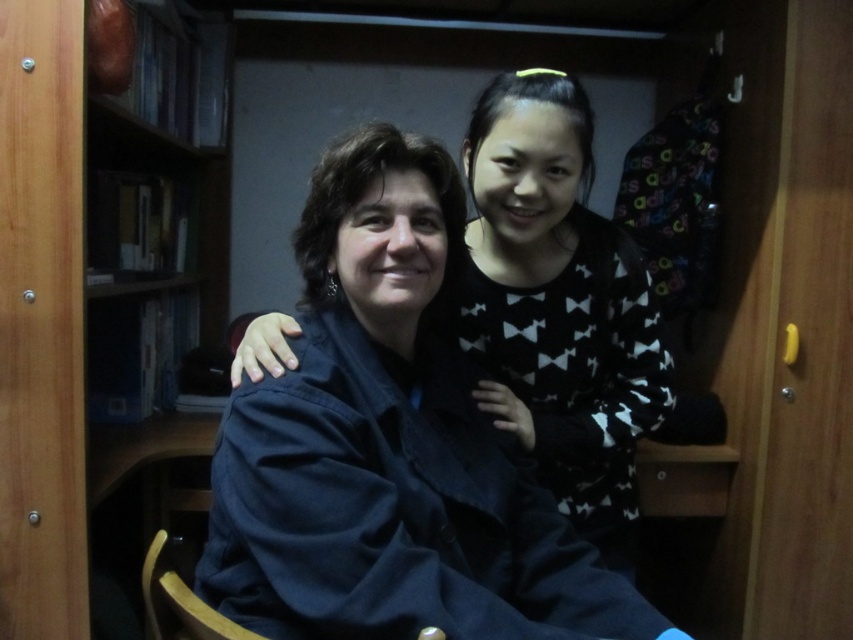
Can you confirm if dark blue cotton robe at center is thinner than black matte sweater at center?

Incorrect, dark blue cotton robe at center's width is not less than black matte sweater at center's.

Where is `dark blue cotton robe at center`? dark blue cotton robe at center is located at coordinates (393, 509).

This screenshot has height=640, width=853. I want to click on dark blue cotton robe at center, so click(393, 509).